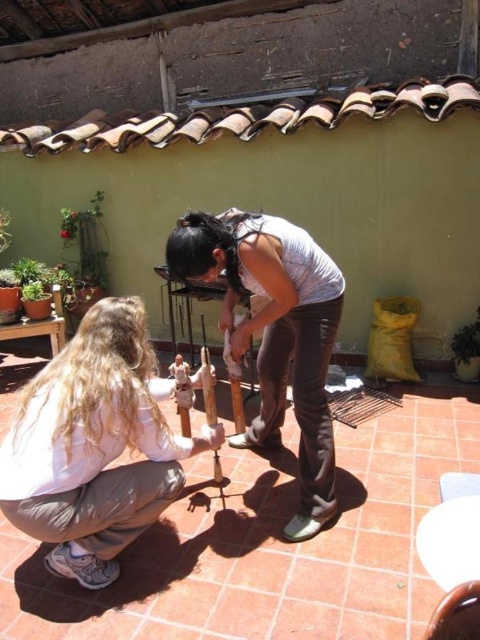
How far apart are light brown hair at lower left and matte white shirt at center?

24.05 inches

This screenshot has height=640, width=480. What do you see at coordinates (95, 445) in the screenshot?
I see `light brown hair at lower left` at bounding box center [95, 445].

Find the location of a particular element. Image resolution: width=480 pixels, height=640 pixels. light brown hair at lower left is located at coordinates (95, 445).